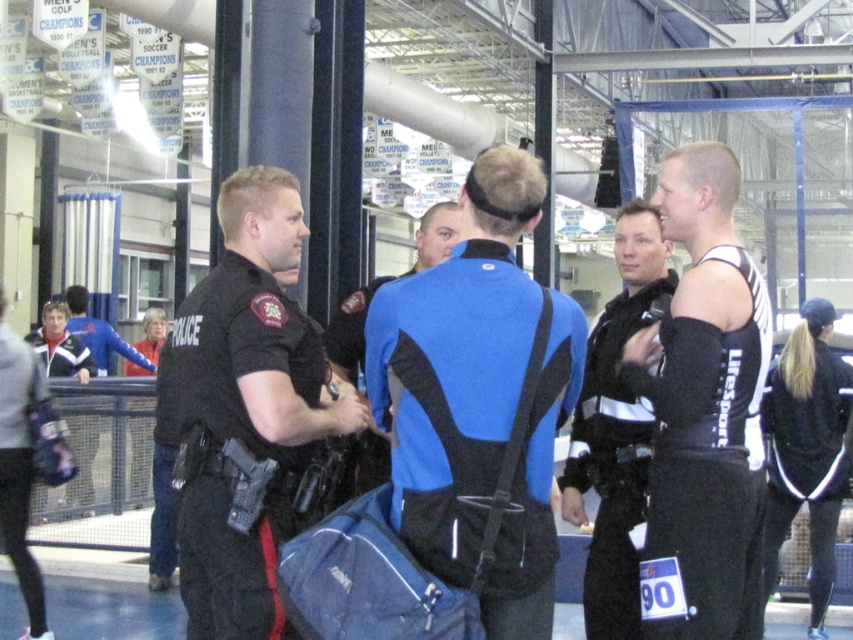
Question: Among these objects, which one is nearest to the camera?

Choices:
 (A) black synthetic jacket at lower right
 (B) matte black jacket at left

Answer: (A)

Question: Is black uniform at center to the left of black synthetic jacket at lower right from the viewer's perspective?

Choices:
 (A) no
 (B) yes

Answer: (B)

Question: Among these points, which one is nearest to the camera?

Choices:
 (A) (836, 493)
 (B) (737, 497)

Answer: (B)

Question: Can you confirm if black/white athletic top at right is positioned to the left of gray fleece jacket at lower left?

Choices:
 (A) no
 (B) yes

Answer: (A)

Question: Is black/white athletic top at right wider than gray fleece jacket at lower left?

Choices:
 (A) no
 (B) yes

Answer: (B)

Question: Which object is closer to the camera taking this photo?

Choices:
 (A) gray fleece jacket at lower left
 (B) blue/black fabric at center

Answer: (B)